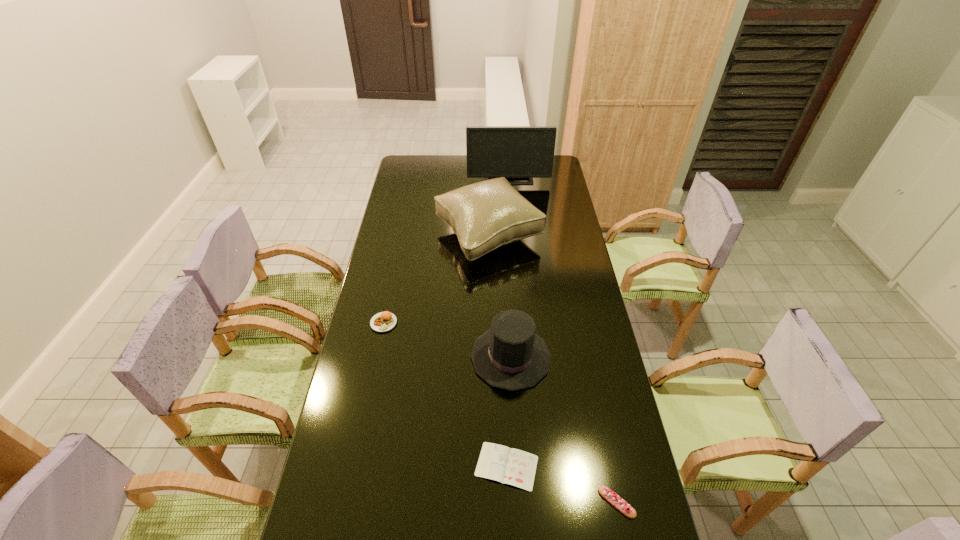
This screenshot has height=540, width=960. I want to click on vacant space located on the front of the second farthest object, so click(491, 320).

Find the location of a particular element. The height and width of the screenshot is (540, 960). vacant area located on the front of the dress hat with the decoration is located at coordinates (382, 357).

At what (x,y) coordinates should I click in order to perform the action: click on free space located on the front of the dress hat with the decoration. Please return your answer as a coordinate pair (x, y). This screenshot has width=960, height=540. Looking at the image, I should click on (408, 357).

This screenshot has height=540, width=960. I want to click on blank space located on the front of the dress hat with the decoration, so click(415, 357).

Image resolution: width=960 pixels, height=540 pixels. What are the coordinates of `vacant space located 0.200m on the back of the leftmost object` in the screenshot? It's located at (394, 275).

I want to click on vacant space located 0.280m on the left of the eclair, so click(493, 502).

In order to click on vacant space positioned 0.330m on the back of the shortest object in this screenshot , I will do `click(502, 350)`.

Locate an element on the screen. The image size is (960, 540). object that is at the far edge is located at coordinates (514, 152).

Locate an element on the screen. The height and width of the screenshot is (540, 960). object that is at the left edge is located at coordinates click(x=382, y=322).

Identify the location of computer monitor positioned at the right edge. The height and width of the screenshot is (540, 960). (514, 152).